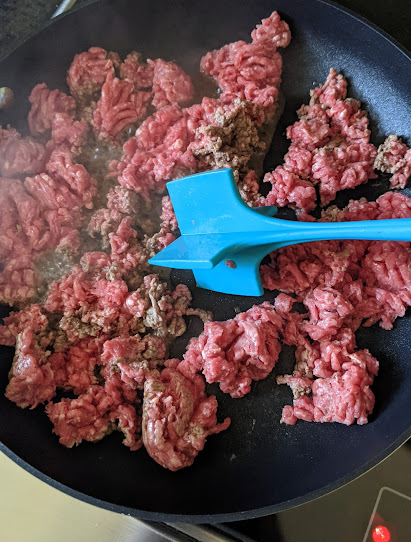
Find the location of a particular element. This screenshot has height=542, width=411. red stove light is on is located at coordinates (385, 532).